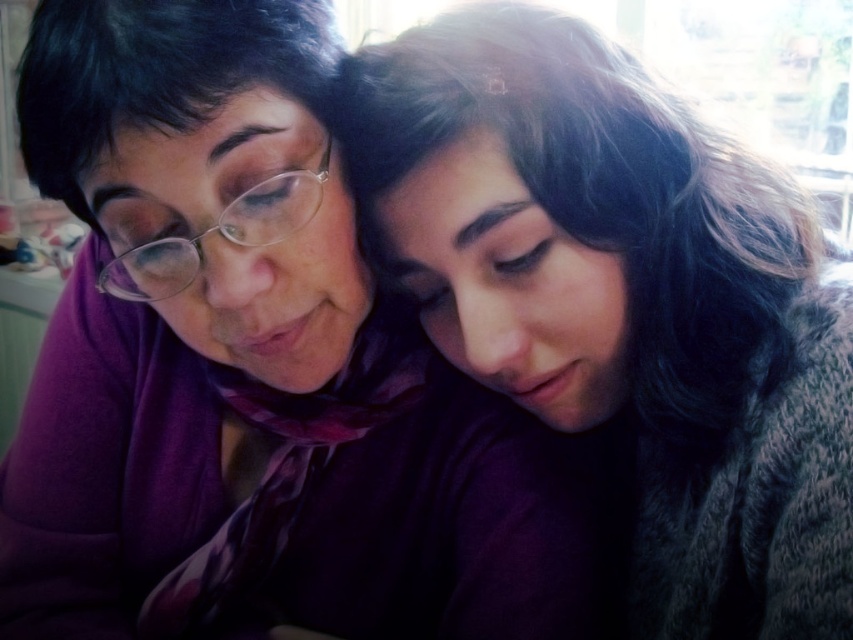
You are a photographer adjusting the focus of your camera. You need to focus on the point closer to the camera between the two points labeled point [76,611] and point [737,422]. Which point should you focus on?

You should focus on point [76,611] because it is closer to the camera than point [737,422].

Based on the scene description, where is the matte purple scarf at upper center located in terms of its 2D coordinates?

The matte purple scarf at upper center is located at the 2D coordinates of point (250, 365).